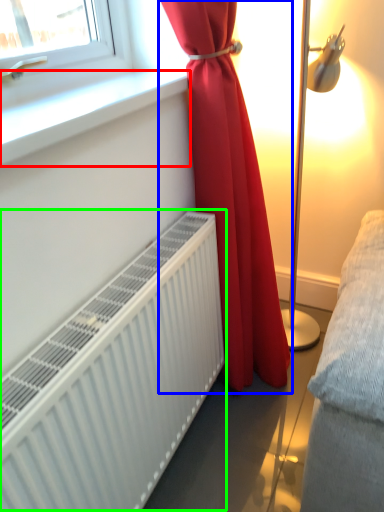
Question: Based on their relative distances, which object is farther from window sill (highlighted by a red box)? Choose from curtain (highlighted by a blue box) and radiator (highlighted by a green box).

Choices:
 (A) curtain
 (B) radiator

Answer: (B)